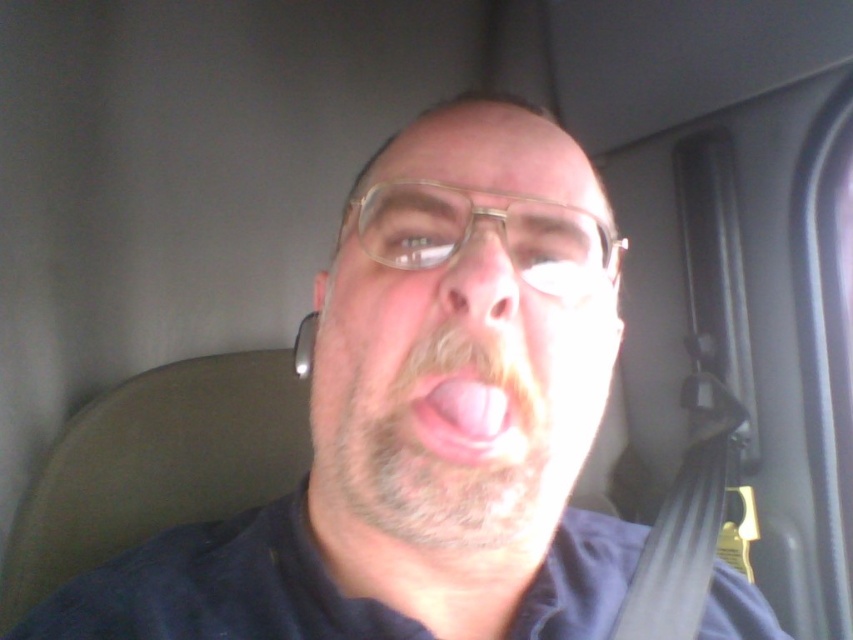
Question: From the image, what is the correct spatial relationship of smooth skin face at center in relation to pink flesh at center?

Choices:
 (A) above
 (B) below

Answer: (A)

Question: Is smooth skin face at center below pink flesh at center?

Choices:
 (A) yes
 (B) no

Answer: (B)

Question: Does smooth skin face at center have a greater width compared to pink flesh at center?

Choices:
 (A) yes
 (B) no

Answer: (A)

Question: Which object is closer to the camera taking this photo?

Choices:
 (A) pink flesh at center
 (B) smooth skin face at center

Answer: (B)

Question: Which of the following is the closest to the observer?

Choices:
 (A) smooth skin face at center
 (B) pink flesh at center

Answer: (A)